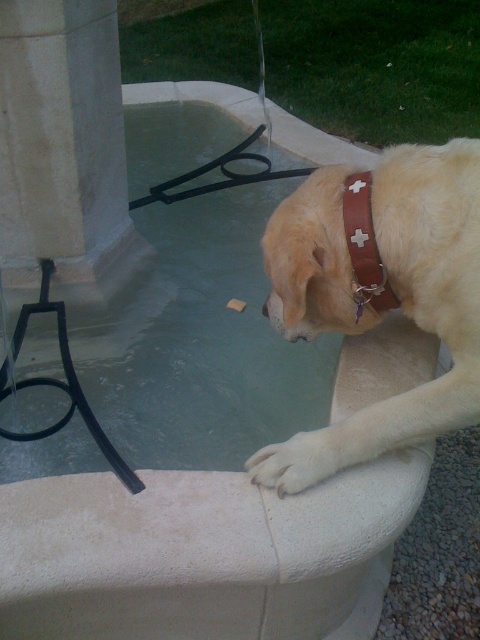
Question: Can you confirm if light brown leather collar at upper right is thinner than white fur paw at lower center?

Choices:
 (A) yes
 (B) no

Answer: (B)

Question: Which of the following is the farthest from the observer?

Choices:
 (A) light brown leather collar at upper right
 (B) white stone pillar at left
 (C) brown leather neckband at upper right
 (D) white fur paw at lower center

Answer: (B)

Question: Estimate the real-world distances between objects in this image. Which object is farther from the white stone pillar at left?

Choices:
 (A) brown leather neckband at upper right
 (B) white fur paw at lower center
 (C) light brown leather collar at upper right

Answer: (B)

Question: Is white stone pillar at left to the right of white fur paw at lower center from the viewer's perspective?

Choices:
 (A) no
 (B) yes

Answer: (A)

Question: Is light brown leather collar at upper right closer to camera compared to brown leather neckband at upper right?

Choices:
 (A) yes
 (B) no

Answer: (A)

Question: Among these objects, which one is farthest from the camera?

Choices:
 (A) light brown leather collar at upper right
 (B) white stone pillar at left
 (C) white fur paw at lower center
 (D) brown leather neckband at upper right

Answer: (B)